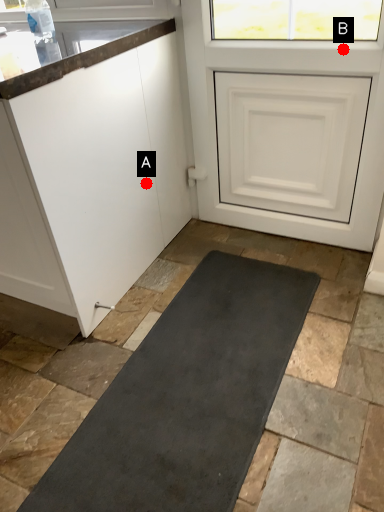
Question: Two points are circled on the image, labeled by A and B beside each circle. Which point is farther from the camera taking this photo?

Choices:
 (A) A is further
 (B) B is further

Answer: (A)